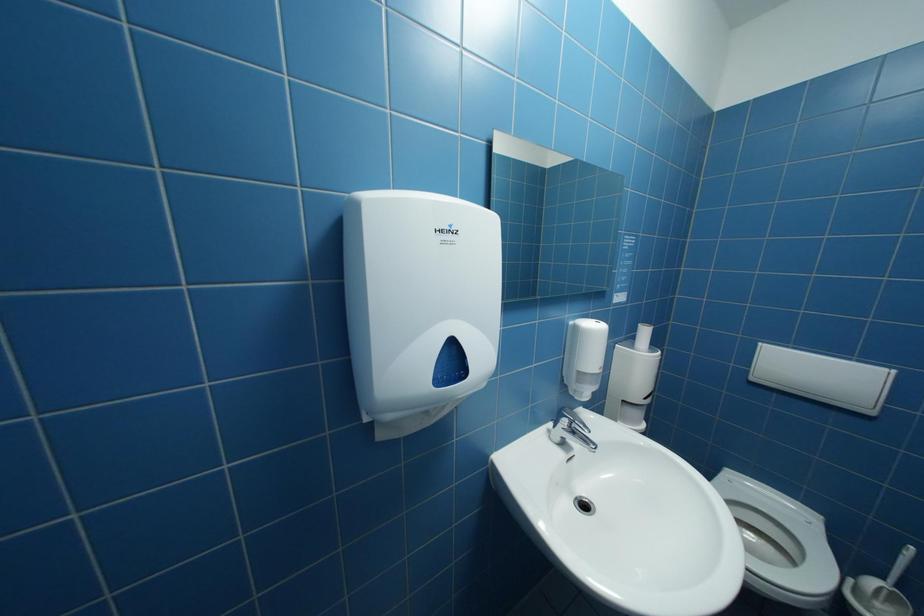
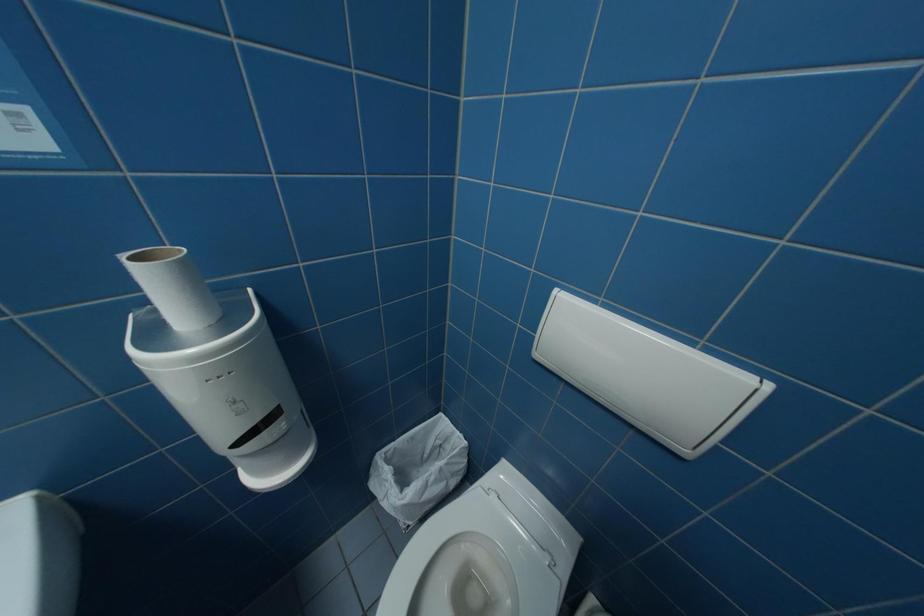
The images are taken continuously from a first-person perspective. In which direction are you moving?

The cameraman moved toward right, forward.